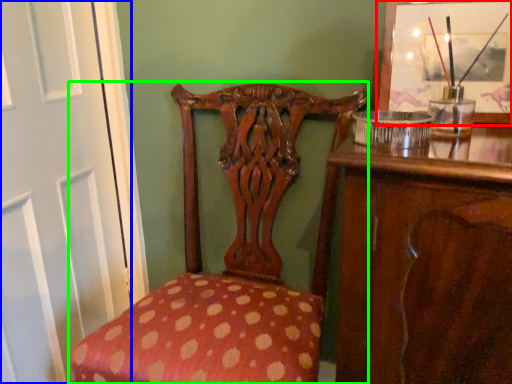
Question: Which is nearer to the picture frame (highlighted by a red box)? screen door (highlighted by a blue box) or chair (highlighted by a green box).

Choices:
 (A) screen door
 (B) chair

Answer: (B)